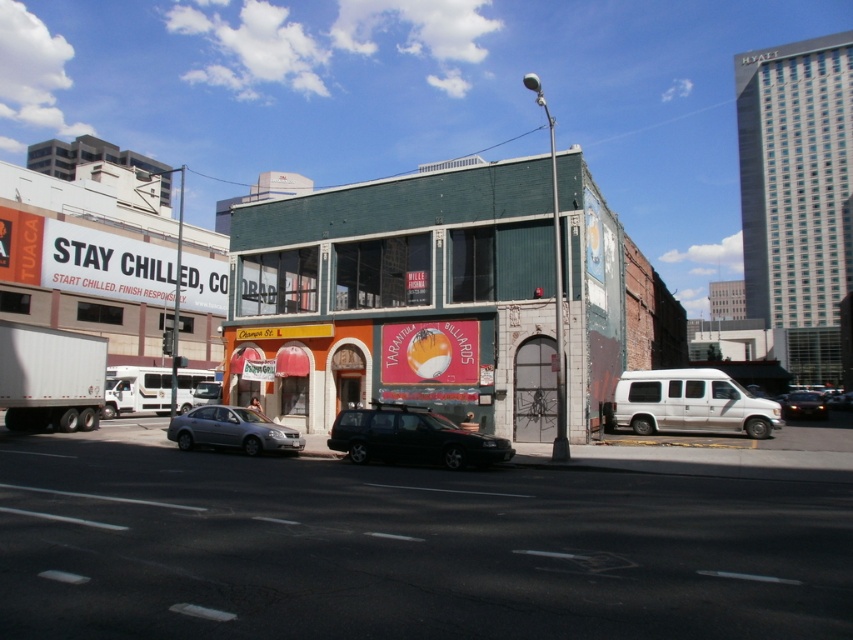
You are a delivery driver who needs to park your vehicle between the green brick building at center and the shiny black sedan at center. Which object should you position your vehicle closer to in order to maximize parking space?

A: The green brick building at center occupies less space than the shiny black sedan at center, so positioning closer to the green brick building at center would allow more space for parking.

You are a delivery driver who needs to park your vehicle between the silver metallic van at right and the shiny black sedan at center. Based on the scene, can you safely park your car there?

The silver metallic van at right is closer to the viewer than the shiny black sedan at center, so there is a gap between them. However, without knowing the exact distance between the two vehicles, it is uncertain if there is enough space for your car to park safely between them.

You are a delivery driver who needs to park your silver metallic van at right at a specific spot marked by point (x=689, y=403). Can you confirm if the van is already parked at that location?

The silver metallic van at right is represented by point (x=689, y=403), so yes, the van is already parked at the specified location.